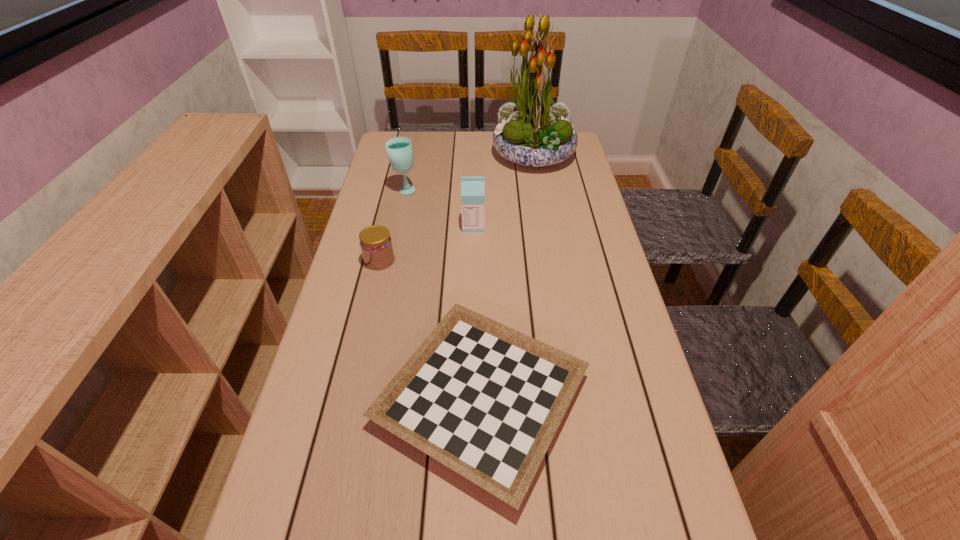
Locate an element on the screen. This screenshot has height=540, width=960. free space between the glass and the flower arrangement is located at coordinates (469, 173).

Choose which object is the second nearest neighbor to the glass. Please provide its 2D coordinates. Your answer should be formatted as a tuple, i.e. [(x, y)], where the tuple contains the x and y coordinates of a point satisfying the conditions above.

[(532, 131)]

Identify which object is the fourth closest to the glass. Please provide its 2D coordinates. Your answer should be formatted as a tuple, i.e. [(x, y)], where the tuple contains the x and y coordinates of a point satisfying the conditions above.

[(485, 400)]

Image resolution: width=960 pixels, height=540 pixels. Identify the location of free region that satisfies the following two spatial constraints: 1. on the back side of the milk carton; 2. on the right side of the second shortest object. (388, 226).